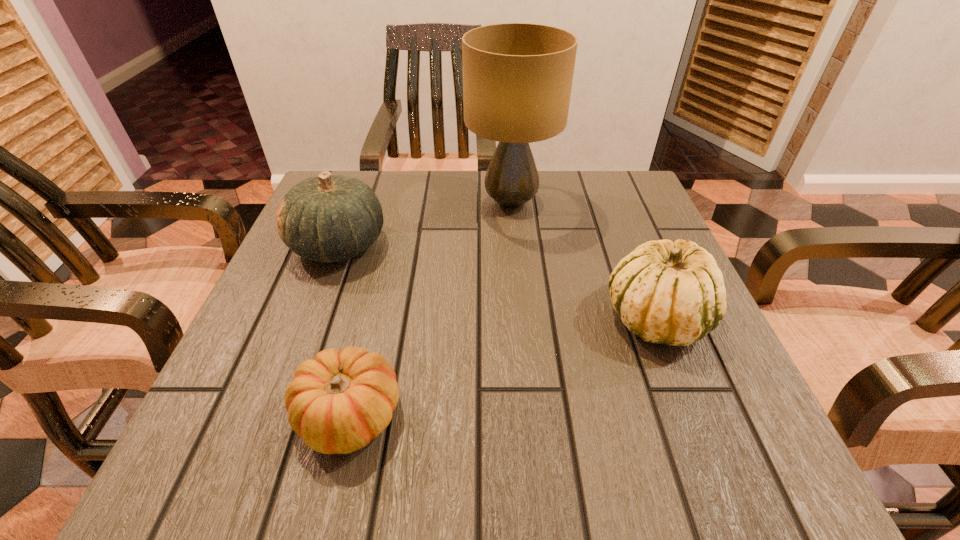
You are a GUI agent. You are given a task and a screenshot of the screen. Output one action in this format:
    pyautogui.click(x=<x>, y=<y>)
    Task: Click on the vacant space located on the right of the nearest object
    
    Given the screenshot: What is the action you would take?
    pyautogui.click(x=548, y=415)

This screenshot has width=960, height=540. I want to click on lampshade positioned at the far edge, so click(517, 77).

The width and height of the screenshot is (960, 540). What are the coordinates of `gourd located in the far edge section of the desktop` in the screenshot? It's located at (328, 218).

In order to click on object that is at the near edge in this screenshot , I will do `click(338, 402)`.

At what (x,y) coordinates should I click in order to perform the action: click on object at the right edge. Please return your answer as a coordinate pair (x, y). The height and width of the screenshot is (540, 960). Looking at the image, I should click on (667, 292).

You are a GUI agent. You are given a task and a screenshot of the screen. Output one action in this format:
    pyautogui.click(x=<x>, y=<y>)
    Task: Click on the object that is at the far left corner
    This screenshot has height=540, width=960.
    Given the screenshot: What is the action you would take?
    pyautogui.click(x=328, y=218)

The height and width of the screenshot is (540, 960). What are the coordinates of `object present at the near left corner` in the screenshot? It's located at (338, 402).

At what (x,y) coordinates should I click in order to perform the action: click on vacant space at the far edge of the desktop. Please return your answer as a coordinate pair (x, y). The height and width of the screenshot is (540, 960). Looking at the image, I should click on (477, 206).

This screenshot has width=960, height=540. What are the coordinates of `vacant space at the near edge of the desktop` in the screenshot? It's located at (524, 465).

You are a GUI agent. You are given a task and a screenshot of the screen. Output one action in this format:
    pyautogui.click(x=<x>, y=<y>)
    Task: Click on the free space at the left edge of the desktop
    
    Given the screenshot: What is the action you would take?
    pyautogui.click(x=296, y=273)